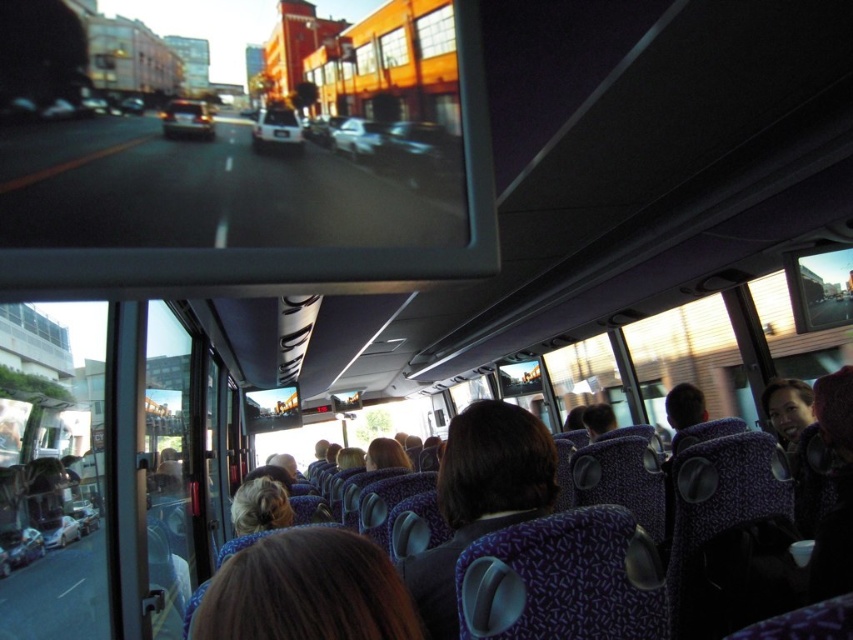
You are a tour guide standing in the back of the bus and need to hand out maps to two passengers. The first passenger has brown hair at center and the second has matte black hair at upper right. If you walk towards them both, which passenger will you reach first?

The brown hair at center is closer to you than the matte black hair at upper right since they are 3.11 meters apart. Therefore, you will reach the brown hair at center first.

You are a passenger sitting in the purple fabric seat at center and want to look at the person with matte black hair at upper right. Which direction should you turn your head to see them?

The purple fabric seat at center is to the left of matte black hair at upper right, so you should turn your head to the right to see them.